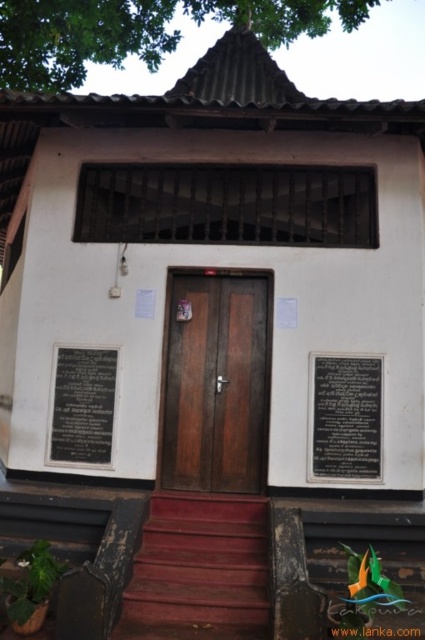
Question: Can you confirm if brown wooden door at center is smaller than black polished stone plaque at center?

Choices:
 (A) yes
 (B) no

Answer: (B)

Question: Which of the following is the farthest from the observer?

Choices:
 (A) brown wooden door at center
 (B) smooth red stairs at center
 (C) black polished stone plaque at center
 (D) black polished stone plaque at lower left

Answer: (D)

Question: Considering the real-world distances, which object is closest to the smooth red stairs at center?

Choices:
 (A) black polished stone plaque at center
 (B) black polished stone plaque at lower left
 (C) brown wooden door at center

Answer: (C)

Question: Can you confirm if smooth red stairs at center is positioned to the right of black polished stone plaque at center?

Choices:
 (A) no
 (B) yes

Answer: (A)

Question: Which of the following is the farthest from the observer?

Choices:
 (A) black polished stone plaque at center
 (B) black polished stone plaque at lower left
 (C) smooth red stairs at center

Answer: (B)

Question: Does brown wooden door at center come behind black polished stone plaque at lower left?

Choices:
 (A) no
 (B) yes

Answer: (A)